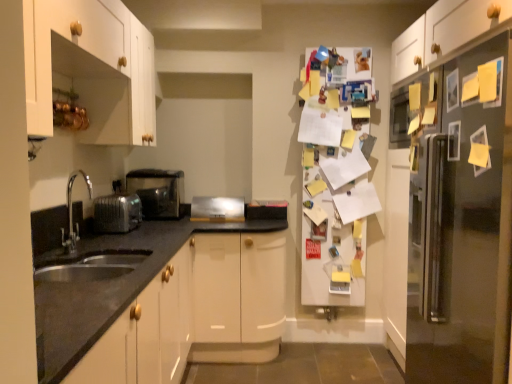
Where is `satin silver toaster at lower left, which is the 3th appliance from back to front`? The height and width of the screenshot is (384, 512). satin silver toaster at lower left, which is the 3th appliance from back to front is located at coordinates (117, 213).

Measure the distance between point (131, 206) and camera.

2.51 meters.

Locate an element on the screen. satin silver toaster at lower left, which is the first appliance in back-to-front order is located at coordinates (157, 191).

This screenshot has height=384, width=512. Describe the element at coordinates (463, 227) in the screenshot. I see `satin silver refrigerator at right, the first fridge positioned from the right` at that location.

You are a GUI agent. You are given a task and a screenshot of the screen. Output one action in this format:
    pyautogui.click(x=<x>, y=<y>)
    Task: Click on the satin silver toaster at center, which is counted as the second appliance, starting from the front
    The image size is (512, 384).
    Given the screenshot: What is the action you would take?
    pyautogui.click(x=217, y=209)

The image size is (512, 384). What do you see at coordinates (335, 178) in the screenshot? I see `white paper covered fridge at center, arranged as the second fridge when viewed from the front` at bounding box center [335, 178].

Where is `satin silver toaster at lower left, positioned as the third appliance in right-to-left order`? Image resolution: width=512 pixels, height=384 pixels. satin silver toaster at lower left, positioned as the third appliance in right-to-left order is located at coordinates (117, 213).

Is white wood cabinet at upper left taller or shorter than white paper covered fridge at center, arranged as the 1th fridge when viewed from the back?

Considering their sizes, white wood cabinet at upper left has less height than white paper covered fridge at center, arranged as the 1th fridge when viewed from the back.

Could you measure the distance between white wood cabinet at upper left and white paper covered fridge at center, arranged as the second fridge when viewed from the right?

The distance of white wood cabinet at upper left from white paper covered fridge at center, arranged as the second fridge when viewed from the right, is 4.61 feet.

Is white wood cabinet at upper left not within white paper covered fridge at center, arranged as the second fridge when viewed from the right?

Yes.

Which object is positioned more to the right, satin silver toaster at lower left, positioned as the 1th appliance in front-to-back order, or satin silver refrigerator at right, the first fridge positioned from the right?

satin silver refrigerator at right, the first fridge positioned from the right, is more to the right.

Where is `the 2nd appliance located above the satin silver refrigerator at right, the first fridge positioned from the right (from a real-world perspective)`? the 2nd appliance located above the satin silver refrigerator at right, the first fridge positioned from the right (from a real-world perspective) is located at coordinates 117,213.

Is satin silver toaster at lower left, positioned as the third appliance in right-to-left order, aimed at satin silver refrigerator at right, placed as the 1th fridge when sorted from front to back?

Yes, satin silver toaster at lower left, positioned as the third appliance in right-to-left order, is turned towards satin silver refrigerator at right, placed as the 1th fridge when sorted from front to back.

Consider the image. From a real-world perspective, which object rests below the other?

satin silver toaster at lower left, which appears as the second appliance when viewed from the left.

Are white wood cabinet at upper left and satin silver toaster at lower left, which appears as the second appliance when viewed from the right, located far from each other?

No, white wood cabinet at upper left is in close proximity to satin silver toaster at lower left, which appears as the second appliance when viewed from the right.

Can you confirm if white wood cabinet at upper left is shorter than satin silver toaster at lower left, which appears as the second appliance when viewed from the right?

In fact, white wood cabinet at upper left may be taller than satin silver toaster at lower left, which appears as the second appliance when viewed from the right.

From the image's perspective, is white wood cabinet at upper left beneath satin silver toaster at lower left, which appears as the second appliance when viewed from the right?

Incorrect, from the image's perspective, white wood cabinet at upper left is higher than satin silver toaster at lower left, which appears as the second appliance when viewed from the right.

Would you say white paper covered fridge at center, arranged as the second fridge when viewed from the right, is outside satin silver refrigerator at right, which is counted as the second fridge, starting from the left?

Yes, white paper covered fridge at center, arranged as the second fridge when viewed from the right, is not within satin silver refrigerator at right, which is counted as the second fridge, starting from the left.

Looking at this image, does white paper covered fridge at center, the 1th fridge from the left, have a greater height compared to satin silver refrigerator at right, which is counted as the second fridge, starting from the left?

Correct, white paper covered fridge at center, the 1th fridge from the left, is much taller as satin silver refrigerator at right, which is counted as the second fridge, starting from the left.

In the scene shown: Between white paper covered fridge at center, arranged as the 1th fridge when viewed from the back, and satin silver refrigerator at right, the first fridge positioned from the right, which one is positioned in front?

satin silver refrigerator at right, the first fridge positioned from the right, is in front.

Is point (326, 89) in front of point (485, 159)?

No, (326, 89) is further to viewer.

What's the angular difference between satin nickel faucet at lower left and white wood cabinet at upper left's facing directions?

They differ by 1.49 degrees in their facing directions.

From the image's perspective, which is above, satin nickel faucet at lower left or white wood cabinet at upper left?

white wood cabinet at upper left appears higher in the image.

Would you say satin nickel faucet at lower left is inside or outside white wood cabinet at upper left?

satin nickel faucet at lower left is outside white wood cabinet at upper left.

From a real-world perspective, who is located lower, satin nickel faucet at lower left or white wood cabinet at upper left?

satin nickel faucet at lower left is physically lower.

Considering the sizes of satin silver toaster at lower left, which is the first appliance in back-to-front order, and satin nickel faucet at lower left in the image, is satin silver toaster at lower left, which is the first appliance in back-to-front order, taller or shorter than satin nickel faucet at lower left?

Clearly, satin silver toaster at lower left, which is the first appliance in back-to-front order, is shorter compared to satin nickel faucet at lower left.

Is satin nickel faucet at lower left at the back of satin silver toaster at lower left, the third appliance when ordered from front to back?

satin silver toaster at lower left, the third appliance when ordered from front to back, does not have its back to satin nickel faucet at lower left.

Who is more distant, satin silver toaster at lower left, the third appliance when ordered from front to back, or satin nickel faucet at lower left?

satin silver toaster at lower left, the third appliance when ordered from front to back, is further away from the camera.

Is satin silver toaster at lower left, marked as the first appliance in a left-to-right arrangement, located within white wood cabinet at upper left?

That's incorrect, satin silver toaster at lower left, marked as the first appliance in a left-to-right arrangement, is not inside white wood cabinet at upper left.

Between white wood cabinet at upper left and satin silver toaster at lower left, which is the 3th appliance from back to front, which one has smaller width?

satin silver toaster at lower left, which is the 3th appliance from back to front, is thinner.

Can you see white wood cabinet at upper left touching satin silver toaster at lower left, positioned as the third appliance in right-to-left order?

No, white wood cabinet at upper left is not next to satin silver toaster at lower left, positioned as the third appliance in right-to-left order.

Considering the relative positions of white wood cabinet at upper left and satin silver toaster at lower left, positioned as the third appliance in right-to-left order, in the image provided, is white wood cabinet at upper left to the right of satin silver toaster at lower left, positioned as the third appliance in right-to-left order, from the viewer's perspective?

Yes, white wood cabinet at upper left is to the right of satin silver toaster at lower left, positioned as the third appliance in right-to-left order.

From the image's perspective, count 1st fridges downward from the white wood cabinet at upper left and point to it. Please provide its 2D coordinates.

[(335, 178)]

Find the location of a particular element. The image size is (512, 384). the 3rd appliance counting from the left of the satin silver refrigerator at right, placed as the 1th fridge when sorted from front to back is located at coordinates (117, 213).

Which object lies further to the anchor point satin nickel faucet at lower left, satin silver refrigerator at right, which is the 2th fridge from back to front, or white wood cabinet at upper left?

satin silver refrigerator at right, which is the 2th fridge from back to front, is further to satin nickel faucet at lower left.

When comparing their distances from satin silver toaster at lower left, the third appliance when ordered from front to back, does satin silver toaster at lower left, positioned as the 1th appliance in front-to-back order, or white wood cabinet at upper left seem further?

white wood cabinet at upper left is further to satin silver toaster at lower left, the third appliance when ordered from front to back.

Estimate the real-world distances between objects in this image. Which object is closer to white paper covered fridge at center, arranged as the second fridge when viewed from the right, satin silver refrigerator at right, the first fridge positioned from the right, or white wood cabinet at upper left?

satin silver refrigerator at right, the first fridge positioned from the right, is closer to white paper covered fridge at center, arranged as the second fridge when viewed from the right.

When comparing their distances from satin silver refrigerator at right, which is counted as the second fridge, starting from the left, does satin silver toaster at lower left, the third appliance when ordered from front to back, or white wood cabinet at upper left seem further?

satin silver toaster at lower left, the third appliance when ordered from front to back.

Estimate the real-world distances between objects in this image. Which object is closer to white paper covered fridge at center, arranged as the 1th fridge when viewed from the back, satin silver refrigerator at right, placed as the 1th fridge when sorted from front to back, or satin silver toaster at lower left, positioned as the third appliance in right-to-left order?

satin silver refrigerator at right, placed as the 1th fridge when sorted from front to back.

Estimate the real-world distances between objects in this image. Which object is further from satin nickel faucet at lower left, satin silver refrigerator at right, the first fridge positioned from the right, or satin silver toaster at center, which is counted as the second appliance, starting from the front?

satin silver refrigerator at right, the first fridge positioned from the right, is further to satin nickel faucet at lower left.

In the scene shown: Which object lies further to the anchor point white paper covered fridge at center, arranged as the second fridge when viewed from the right, satin nickel faucet at lower left or satin silver toaster at center, which ranks as the 2th appliance in back-to-front order?

satin nickel faucet at lower left lies further to white paper covered fridge at center, arranged as the second fridge when viewed from the right, than the other object.

Based on their spatial positions, is satin silver toaster at center, acting as the 3th appliance starting from the left, or satin silver toaster at lower left, positioned as the third appliance in right-to-left order, further from white paper covered fridge at center, arranged as the second fridge when viewed from the front?

satin silver toaster at lower left, positioned as the third appliance in right-to-left order, is positioned further to the anchor white paper covered fridge at center, arranged as the second fridge when viewed from the front.

Locate an element on the screen. Image resolution: width=512 pixels, height=384 pixels. sink situated between satin silver toaster at lower left, positioned as the third appliance in right-to-left order, and satin silver refrigerator at right, which is counted as the second fridge, starting from the left, from left to right is located at coordinates (79, 255).

Identify the location of sink between white wood cabinet at upper left and white paper covered fridge at center, arranged as the second fridge when viewed from the right, along the z-axis. coord(79,255).

Identify the location of fridge between satin silver refrigerator at right, the first fridge positioned from the right, and satin silver toaster at center, the 1th appliance from the right, from front to back. The width and height of the screenshot is (512, 384). (335, 178).

In order to click on appliance between satin silver toaster at lower left, which is the first appliance in back-to-front order, and white paper covered fridge at center, arranged as the second fridge when viewed from the front, from left to right in this screenshot , I will do `click(217, 209)`.